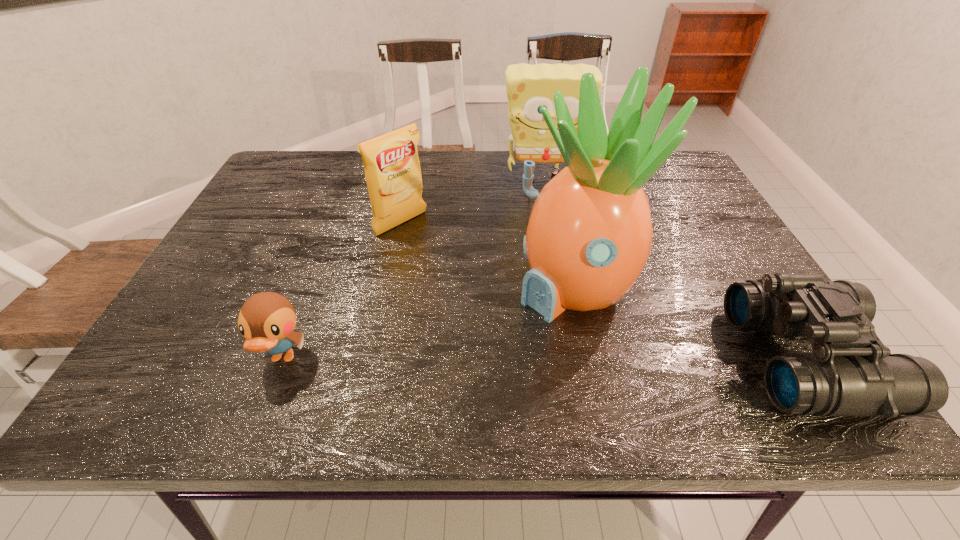
Locate an element on the screen. The width and height of the screenshot is (960, 540). free space that is in between the leftmost object and the binoculars is located at coordinates (545, 359).

The image size is (960, 540). In order to click on free point between the second farthest object and the pineapple in this screenshot , I will do `click(489, 255)`.

At what (x,y) coordinates should I click in order to perform the action: click on vacant area between the tallest object and the third tallest object. Please return your answer as a coordinate pair (x, y). The height and width of the screenshot is (540, 960). Looking at the image, I should click on (489, 255).

Find the location of a particular element. empty space that is in between the farthest object and the fourth nearest object is located at coordinates [x=471, y=202].

Find the location of `empty space that is in between the pineapple and the binoculars`. empty space that is in between the pineapple and the binoculars is located at coordinates (691, 323).

Locate an element on the screen. This screenshot has width=960, height=540. free space between the crisp (potato chip) and the second tallest object is located at coordinates (471, 202).

The height and width of the screenshot is (540, 960). In order to click on vacant point located between the pineapple and the second farthest object in this screenshot , I will do `click(489, 255)`.

Choose which object is the third nearest neighbor to the sponge. Please provide its 2D coordinates. Your answer should be formatted as a tuple, i.e. [(x, y)], where the tuple contains the x and y coordinates of a point satisfying the conditions above.

[(850, 373)]

Choose which object is the fourth nearest neighbor to the rightmost object. Please provide its 2D coordinates. Your answer should be formatted as a tuple, i.e. [(x, y)], where the tuple contains the x and y coordinates of a point satisfying the conditions above.

[(266, 320)]

Identify the location of vacant area in the image that satisfies the following two spatial constraints: 1. on the front-facing side of the leftmost object; 2. through the lenses of the rightmost object. Image resolution: width=960 pixels, height=540 pixels. (282, 359).